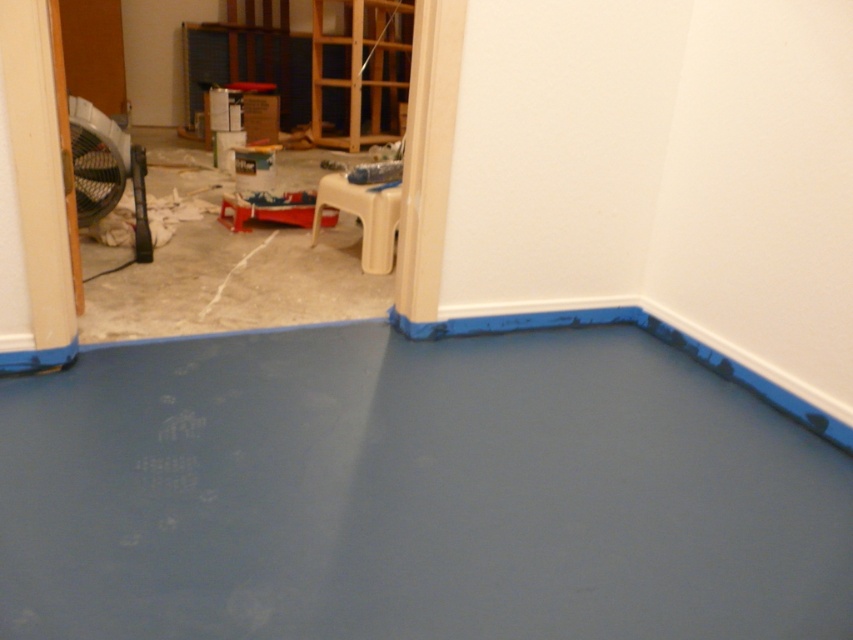
Based on the photo, you are standing in the room with the blue painted floor and need to move to the doorway where the fan is located. Which direction should you walk relative to the smooth concrete floor at center?

Since the smooth concrete floor at center is located at point (x=413, y=492), you should walk towards the doorway in the direction opposite to the smooth concrete floor at center to reach the fan.

You are standing in the room and want to walk to the doorway. Which floor surface, the smooth concrete floor at center or the white concrete floor at left, should you step on first?

You should step on the smooth concrete floor at center first because it is closer to you than the white concrete floor at left.